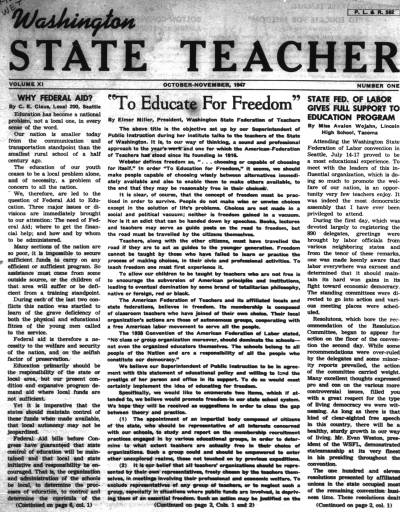
Find the location of a particular element. The height and width of the screenshot is (512, 400). columns is located at coordinates (43, 220), (195, 268), (339, 262).